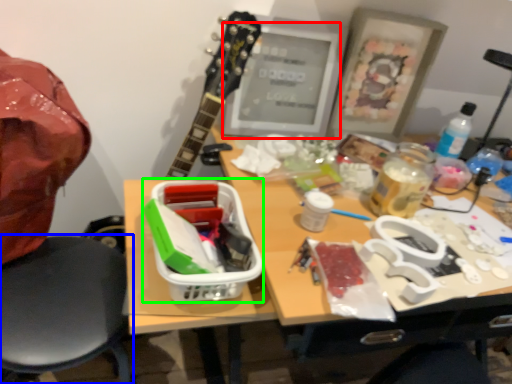
Question: Considering the real-world distances, which object is closest to computer monitor (highlighted by a red box)? chair (highlighted by a blue box) or lunch box (highlighted by a green box).

Choices:
 (A) chair
 (B) lunch box

Answer: (B)